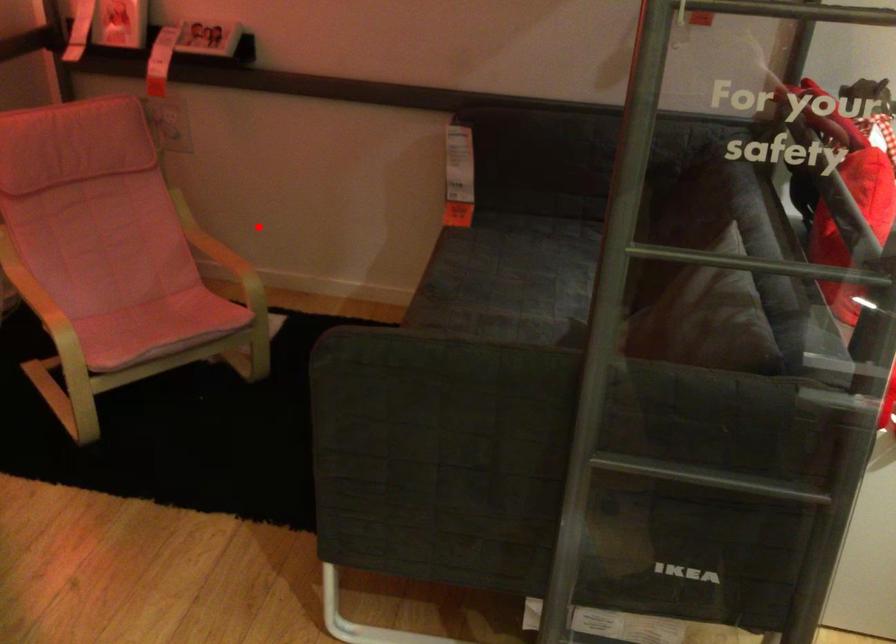
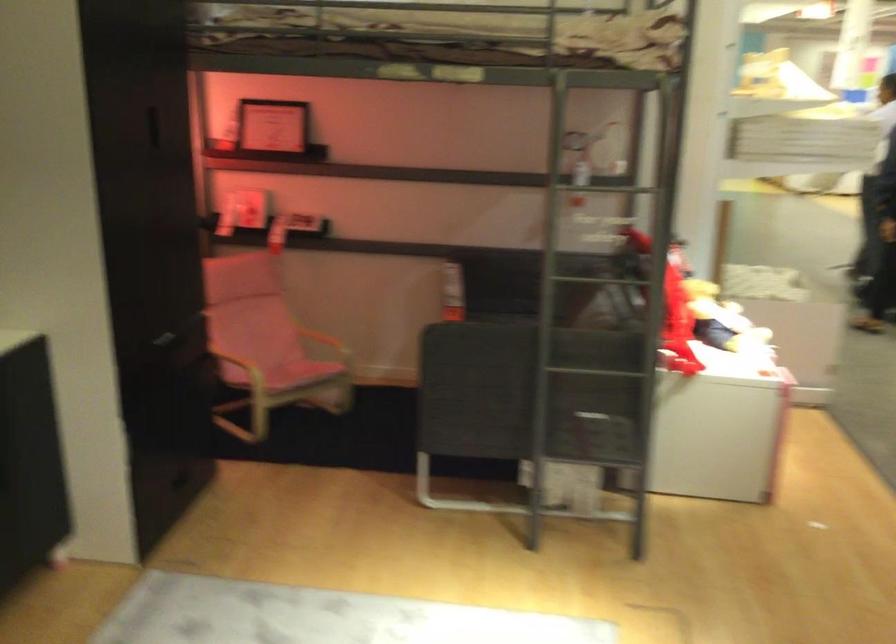
Question: I am providing you with two images of the same scene from different viewpoints. Given a red point in image1, look at the same physical point in image2. Is it:

Choices:
 (A) Closer to the viewpoint
 (B) Farther from the viewpoint

Answer: (B)